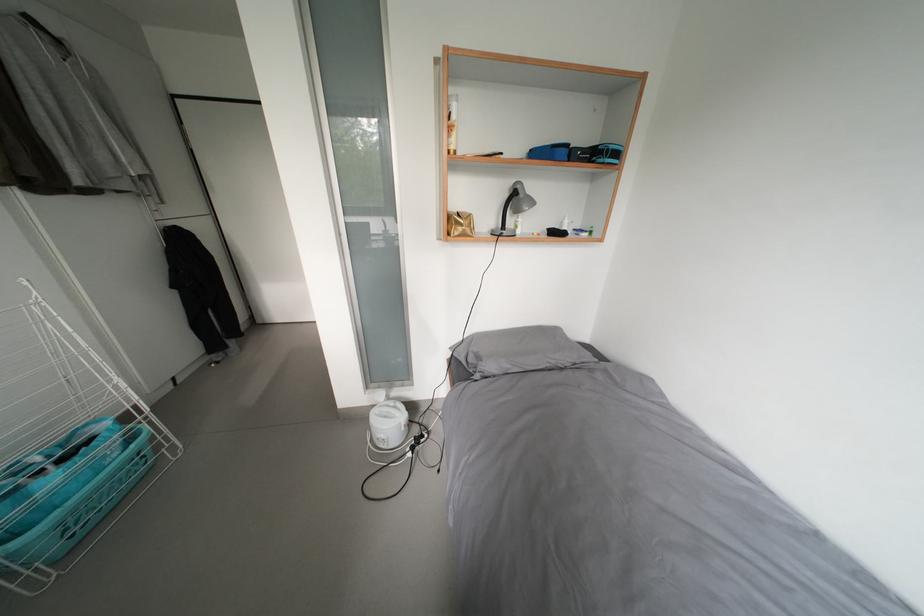
Where is `white humidifier`? Image resolution: width=924 pixels, height=616 pixels. white humidifier is located at coordinates (411, 514).